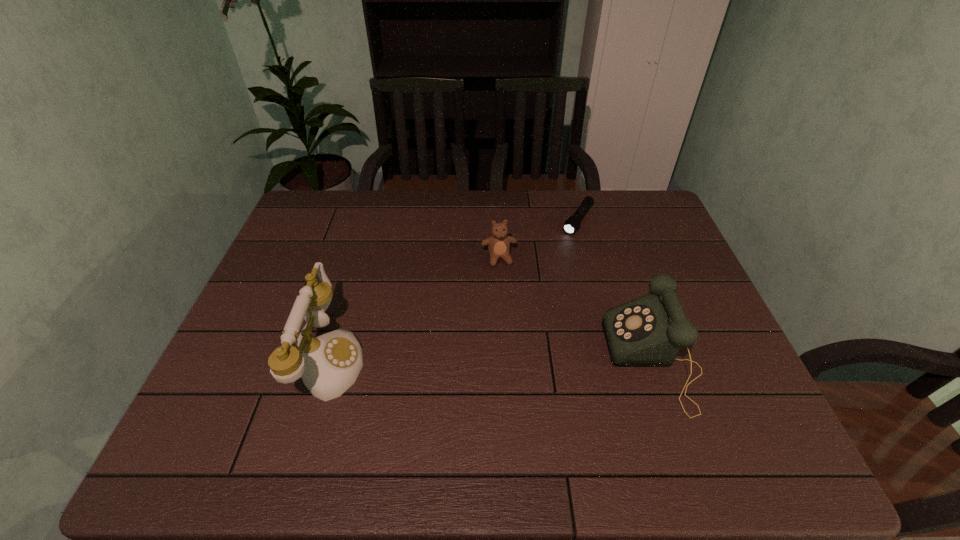
Find the location of a particular element. vacant area in the image that satisfies the following two spatial constraints: 1. on the front side of the second tallest object; 2. on the dial of the shortest object is located at coordinates point(614,360).

You are a GUI agent. You are given a task and a screenshot of the screen. Output one action in this format:
    pyautogui.click(x=<x>, y=<y>)
    Task: Click on the free spot that satisfies the following two spatial constraints: 1. on the front side of the right telephone; 2. on the dial of the third tallest object
    This screenshot has width=960, height=540.
    Given the screenshot: What is the action you would take?
    pyautogui.click(x=503, y=360)

Find the location of a particular element. The image size is (960, 540). vacant region that satisfies the following two spatial constraints: 1. on the back side of the flashlight; 2. on the left side of the third nearest object is located at coordinates (497, 220).

Identify the location of vacant space that satisfies the following two spatial constraints: 1. on the front side of the second shortest object; 2. on the dial of the right telephone. The image size is (960, 540). (503, 360).

The image size is (960, 540). Find the location of `vacant area that satisfies the following two spatial constraints: 1. on the front side of the second shortest object; 2. on the dial of the right telephone`. vacant area that satisfies the following two spatial constraints: 1. on the front side of the second shortest object; 2. on the dial of the right telephone is located at coordinates (503, 360).